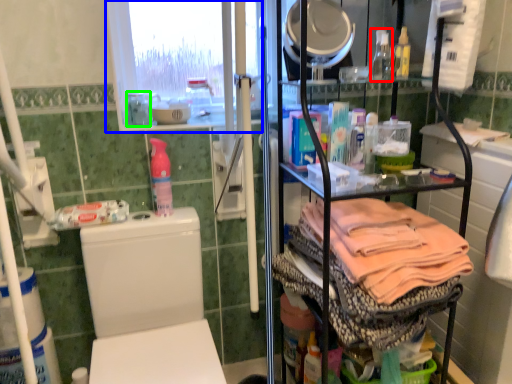
Question: Based on their relative distances, which object is nearer to bottle (highlighted by a red box)? Choose from window screen (highlighted by a blue box) and bottle (highlighted by a green box).

Choices:
 (A) window screen
 (B) bottle

Answer: (A)